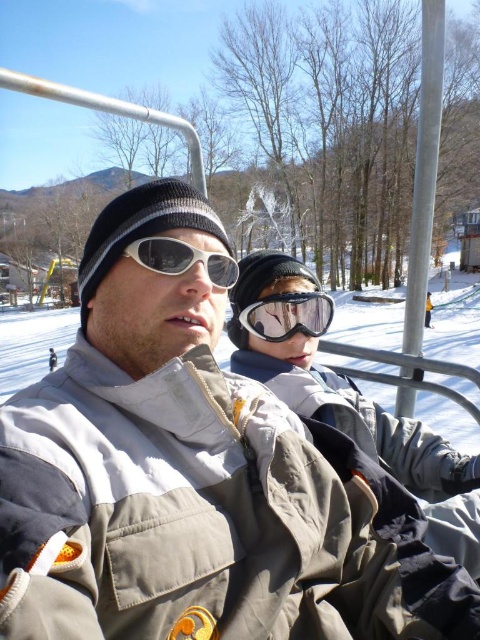
Question: Which point is farther from the camera taking this photo?

Choices:
 (A) (291, 292)
 (B) (228, 259)

Answer: (A)

Question: Can you confirm if transparent plastic goggles at center is positioned to the right of white matte goggles at center?

Choices:
 (A) yes
 (B) no

Answer: (A)

Question: Which point is farther to the camera?

Choices:
 (A) transparent plastic goggles at center
 (B) white matte goggles at center

Answer: (A)

Question: Can you confirm if transparent plastic goggles at center is wider than white matte goggles at center?

Choices:
 (A) yes
 (B) no

Answer: (A)

Question: Can you confirm if transparent plastic goggles at center is bigger than white matte goggles at center?

Choices:
 (A) yes
 (B) no

Answer: (A)